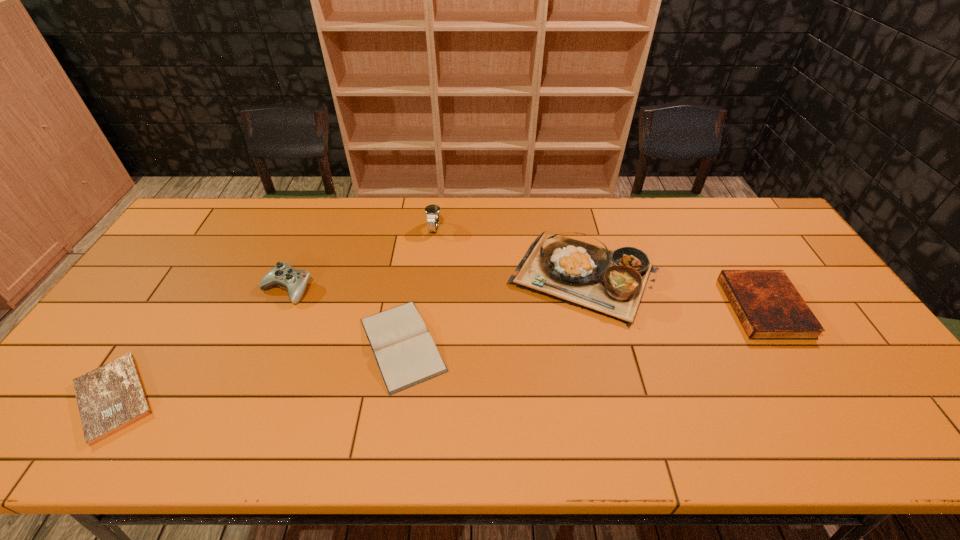
Where is `vacant space located on the front of the watch`? The height and width of the screenshot is (540, 960). vacant space located on the front of the watch is located at coordinates (424, 316).

Where is `vacant area situated on the left of the platter`? Image resolution: width=960 pixels, height=540 pixels. vacant area situated on the left of the platter is located at coordinates pyautogui.click(x=437, y=277).

Image resolution: width=960 pixels, height=540 pixels. In order to click on vacant space located 0.090m on the front of the fourth shortest object in this screenshot , I will do `click(269, 332)`.

You are a GUI agent. You are given a task and a screenshot of the screen. Output one action in this format:
    pyautogui.click(x=<x>, y=<y>)
    Task: Click on the vacant space positioned 0.060m on the spine side of the rightmost object
    The height and width of the screenshot is (540, 960).
    Given the screenshot: What is the action you would take?
    pyautogui.click(x=710, y=307)

You are a GUI agent. You are given a task and a screenshot of the screen. Output one action in this format:
    pyautogui.click(x=<x>, y=<y>)
    Task: Click on the vacant space located 0.050m on the spine side of the rightmost object
    The image size is (960, 540).
    Given the screenshot: What is the action you would take?
    pyautogui.click(x=714, y=307)

Find the location of a particular element. This screenshot has width=960, height=540. vacant space situated on the spine side of the rightmost object is located at coordinates (714, 307).

I want to click on vacant region located on the back of the second shortest Bible, so click(416, 254).

Image resolution: width=960 pixels, height=540 pixels. Find the location of `vacant space located on the right of the shortest Bible`. vacant space located on the right of the shortest Bible is located at coordinates (208, 397).

I want to click on watch located in the far edge section of the desktop, so pos(432,211).

Where is `platter present at the far edge`? The image size is (960, 540). platter present at the far edge is located at coordinates (611, 283).